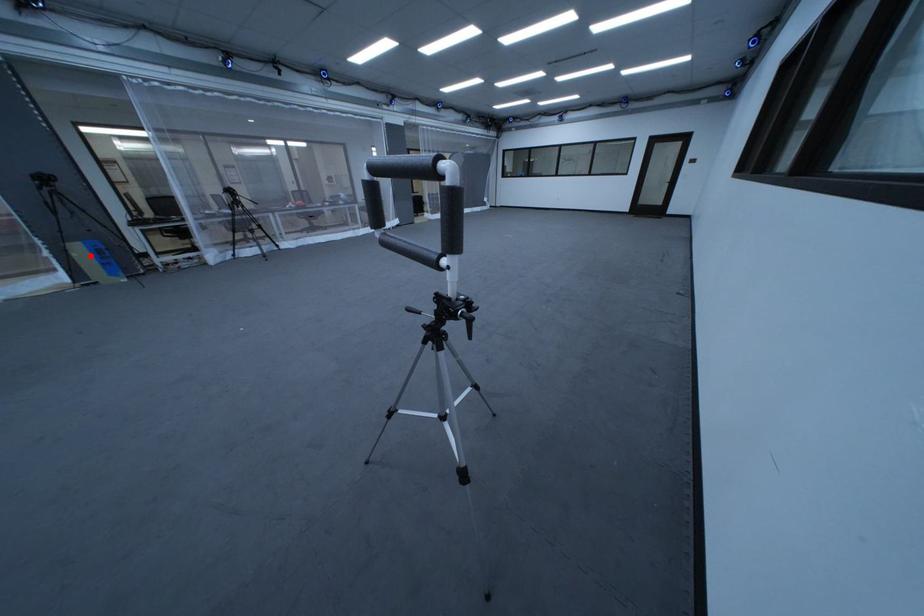
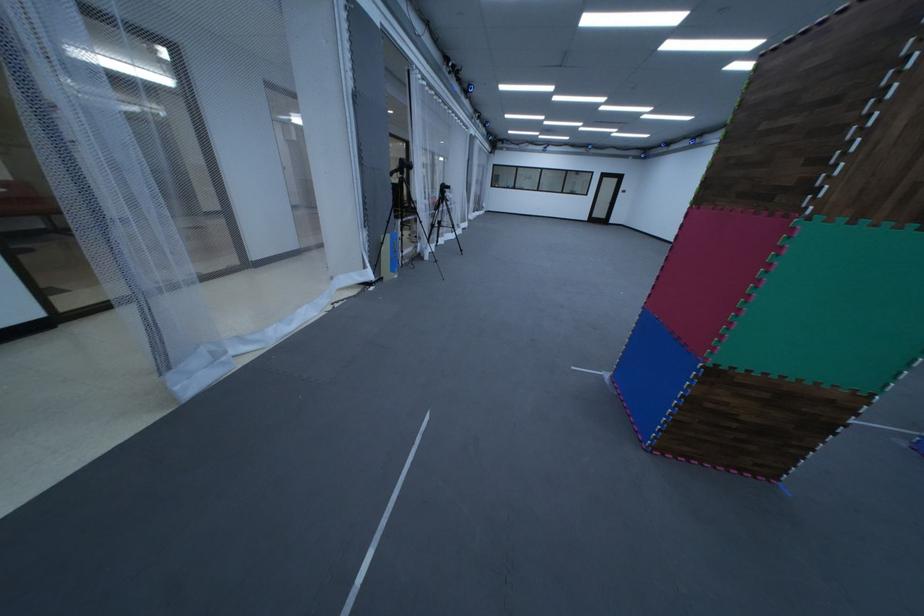
The point at the highlighted location is marked in the first image. Where is the corresponding point in the second image?

(398, 249)